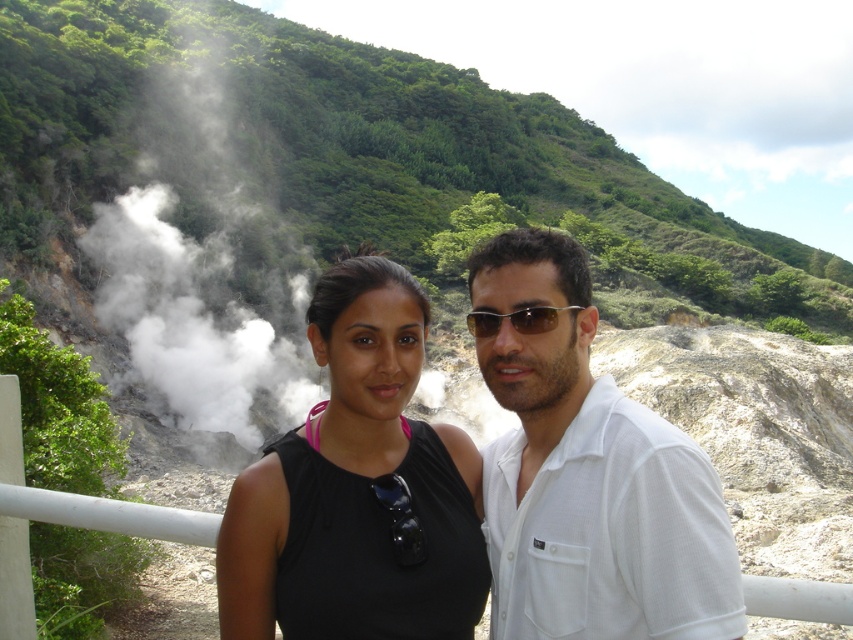
Which is above, green leafy hillside at upper left or white vapor at left?

Positioned higher is green leafy hillside at upper left.

Is green leafy hillside at upper left wider than white vapor at left?

Indeed, green leafy hillside at upper left has a greater width compared to white vapor at left.

Who is more forward, (456,184) or (305,353)?

Point (305,353) is more forward.

This screenshot has width=853, height=640. I want to click on green leafy hillside at upper left, so click(325, 189).

Does point (248, 83) come farther from viewer compared to point (750, 588)?

Yes, it is.

Does point (172, 326) come farther from viewer compared to point (842, 612)?

Yes, point (172, 326) is behind point (842, 612).

The width and height of the screenshot is (853, 640). Identify the location of green leafy hillside at upper left. (325, 189).

Is green leafy hillside at upper left above white textured shirt at center?

Yes, green leafy hillside at upper left is above white textured shirt at center.

Is green leafy hillside at upper left thinner than white textured shirt at center?

No.

What do you see at coordinates (325, 189) in the screenshot?
I see `green leafy hillside at upper left` at bounding box center [325, 189].

Locate an element on the screen. The height and width of the screenshot is (640, 853). green leafy hillside at upper left is located at coordinates (325, 189).